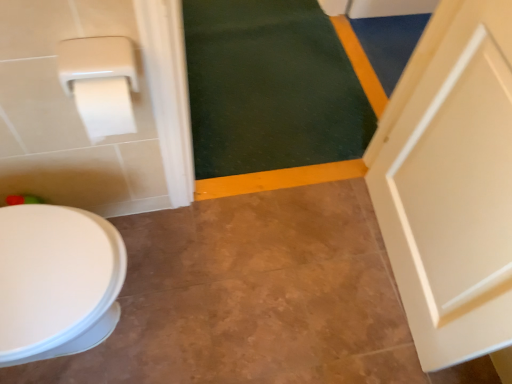
Question: Does dark green carpet at upper center have a lesser height compared to white matte toilet paper at upper left?

Choices:
 (A) no
 (B) yes

Answer: (B)

Question: Is dark green carpet at upper center facing away from white matte toilet paper at upper left?

Choices:
 (A) yes
 (B) no

Answer: (B)

Question: Is dark green carpet at upper center located outside white matte toilet paper at upper left?

Choices:
 (A) no
 (B) yes

Answer: (B)

Question: Is dark green carpet at upper center taller than white matte toilet paper at upper left?

Choices:
 (A) yes
 (B) no

Answer: (B)

Question: Can you confirm if dark green carpet at upper center is smaller than white matte toilet paper at upper left?

Choices:
 (A) yes
 (B) no

Answer: (B)

Question: From a real-world perspective, is dark green carpet at upper center located beneath white matte toilet paper at upper left?

Choices:
 (A) no
 (B) yes

Answer: (B)

Question: Is white matte toilet paper at upper left at the left side of dark green carpet at upper center?

Choices:
 (A) no
 (B) yes

Answer: (B)

Question: Is white matte toilet paper at upper left not near dark green carpet at upper center?

Choices:
 (A) yes
 (B) no

Answer: (A)

Question: Does white matte toilet paper at upper left come behind dark green carpet at upper center?

Choices:
 (A) no
 (B) yes

Answer: (A)

Question: From a real-world perspective, is white matte toilet paper at upper left positioned under dark green carpet at upper center based on gravity?

Choices:
 (A) yes
 (B) no

Answer: (B)

Question: Can you confirm if white matte toilet paper at upper left is bigger than dark green carpet at upper center?

Choices:
 (A) yes
 (B) no

Answer: (B)

Question: Does white matte toilet paper at upper left have a greater width compared to dark green carpet at upper center?

Choices:
 (A) yes
 (B) no

Answer: (B)

Question: Do you think dark green carpet at upper center is within white matte toilet paper at upper left, or outside of it?

Choices:
 (A) inside
 (B) outside

Answer: (B)